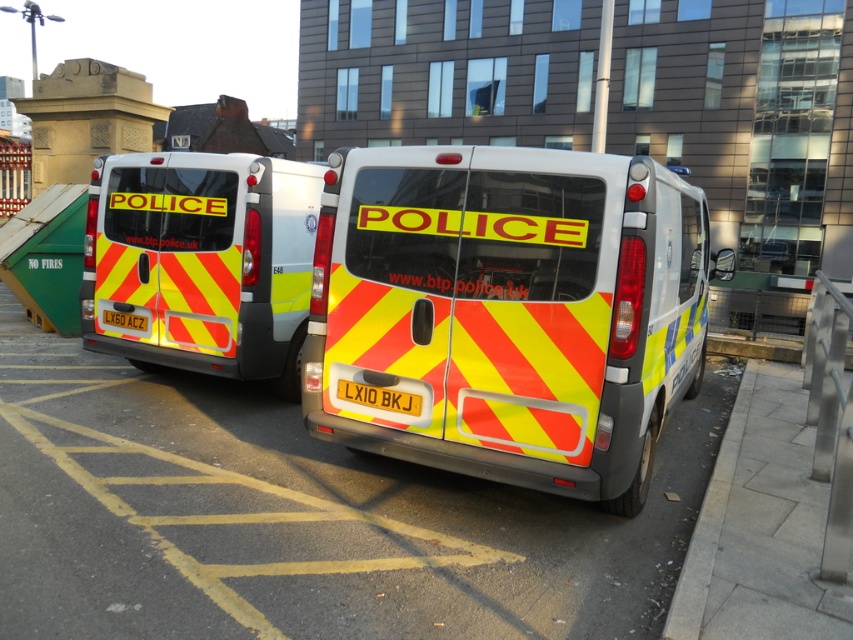
Question: Can you confirm if yellow reflective material police van at center is positioned above yellow reflective plate at rear center?

Choices:
 (A) no
 (B) yes

Answer: (B)

Question: In this image, where is yellow reflective van at center located relative to yellow reflective material police van at center?

Choices:
 (A) left
 (B) right

Answer: (B)

Question: Which point appears closest to the camera in this image?

Choices:
 (A) (418, 406)
 (B) (695, 292)
 (C) (126, 316)

Answer: (A)

Question: Estimate the real-world distances between objects in this image. Which object is closer to the yellow reflective material police van at center?

Choices:
 (A) yellow reflective plate at center
 (B) yellow reflective van at center

Answer: (A)

Question: Based on their relative distances, which object is farther from the yellow reflective material police van at center?

Choices:
 (A) yellow reflective plate at center
 (B) yellow reflective plate at rear center

Answer: (A)

Question: Does yellow reflective material police van at center appear over yellow reflective plate at center?

Choices:
 (A) yes
 (B) no

Answer: (A)